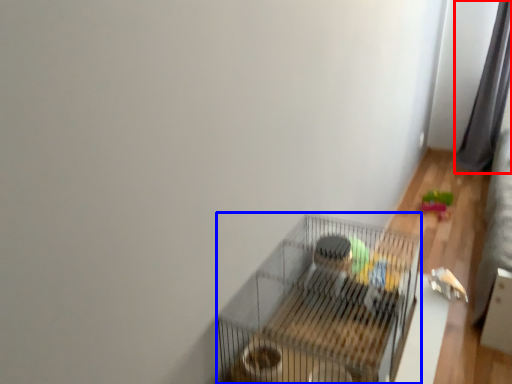
Question: Which object is closer to the camera taking this photo, curtain (highlighted by a red box) or bird cage (highlighted by a blue box)?

Choices:
 (A) curtain
 (B) bird cage

Answer: (B)